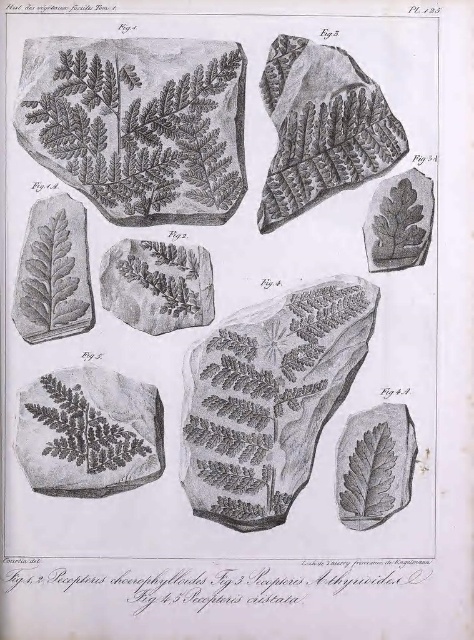
Based on the botanical illustration from the scientific publication, can you determine the spatial relationship between the gray textured leaf at left and the smooth gray leaf at lower right?

The gray textured leaf at left is positioned to the left of the smooth gray leaf at lower right.

Based on the botanical illustration from the scientific publication, if you were to trace a line from the point at the bottom left corner of the image towards the point at the top right corner, would the point labeled as point (x=47, y=214) be encountered before or after the point labeled point (x=207, y=320)?

The point labeled point (x=47, y=214) is in front of point (x=207, y=320), so it would be encountered before the point labeled point (x=207, y=320) when tracing a line from the bottom left to the top right corner of the image.